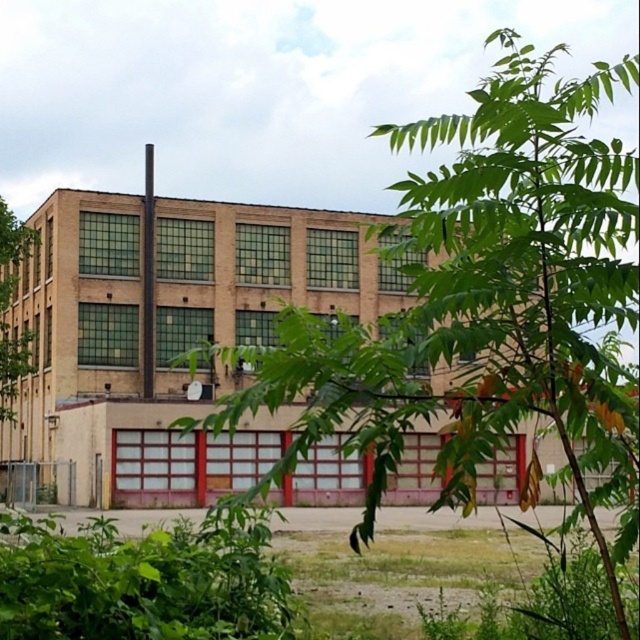
In the scene shown: You are standing in front of the industrial building and want to determine the relative positions of two points marked on the facade. Which of the two points, point [161,547] or point [16,272], is closer to you?

Point [161,547] is closer to the viewer than point [16,272].

You are a landscape architect designing a pathway between the green leafy tree at center and the green leafy tree at left. Which tree requires more space for its canopy considering their widths?

The green leafy tree at center requires more space for its canopy because its width is larger than the green leafy tree at left.

You are standing in front of the brick building at center and want to take a photo of it. However, there is a green leafy plant at lower left blocking your view. Based on their sizes, which object is taller and would require you to move further back to capture both in the frame?

The brick building at center is taller than the green leafy plant at lower left. To capture both in the frame, you would need to move further back to ensure the taller brick building at center fits while also including the shorter green leafy plant at lower left.